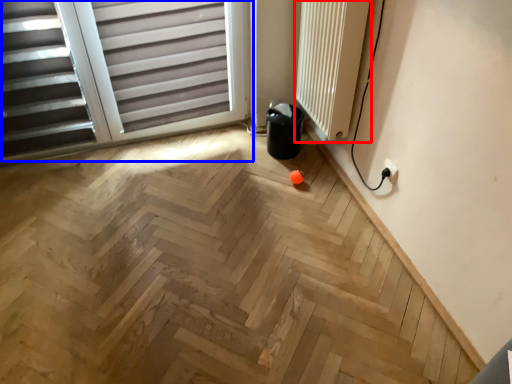
Question: Which point is further to the camera, radiator (highlighted by a red box) or window (highlighted by a blue box)?

Choices:
 (A) radiator
 (B) window

Answer: (B)